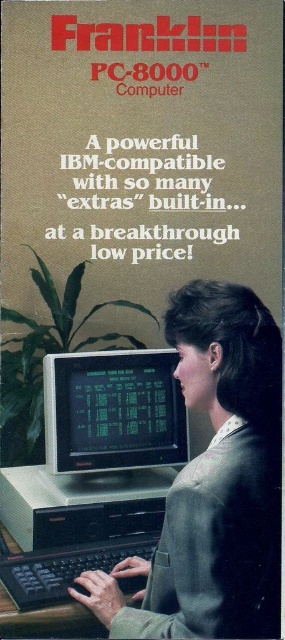
Question: Which of the following is the closest to the observer?

Choices:
 (A) (110, 449)
 (B) (66, 596)
 (C) (259, 556)

Answer: (C)

Question: Can you confirm if matte gray suit at center is smaller than black plastic keyboard at lower center?

Choices:
 (A) no
 (B) yes

Answer: (A)

Question: Which point is farther to the camera?

Choices:
 (A) green matte monitor at center
 (B) matte gray suit at center
 (C) black plastic keyboard at lower center

Answer: (A)

Question: Can you confirm if matte gray suit at center is smaller than black plastic keyboard at lower center?

Choices:
 (A) no
 (B) yes

Answer: (A)

Question: Among these objects, which one is nearest to the camera?

Choices:
 (A) green matte monitor at center
 (B) matte gray suit at center
 (C) black plastic keyboard at lower center

Answer: (B)

Question: Considering the relative positions of matte gray suit at center and green matte monitor at center in the image provided, where is matte gray suit at center located with respect to green matte monitor at center?

Choices:
 (A) left
 (B) right

Answer: (B)